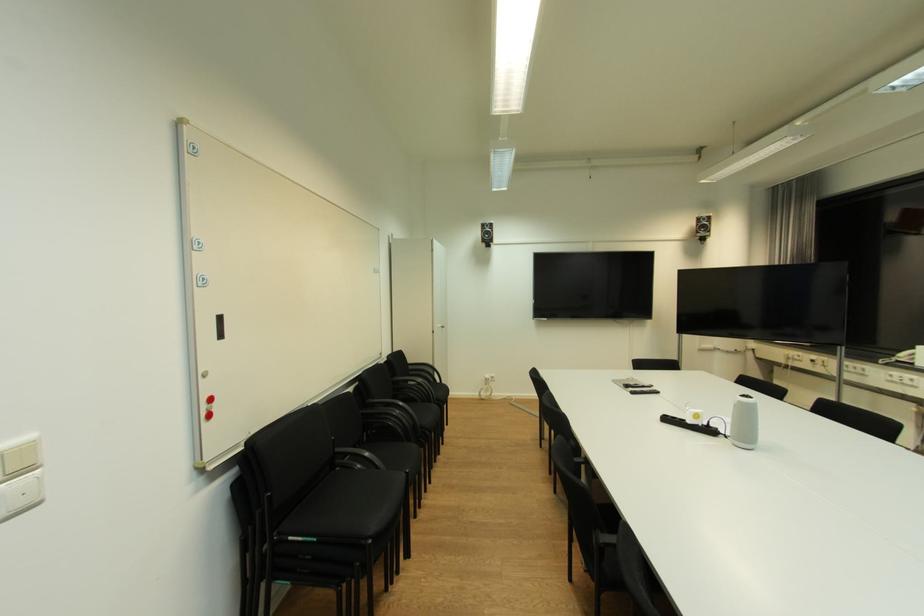
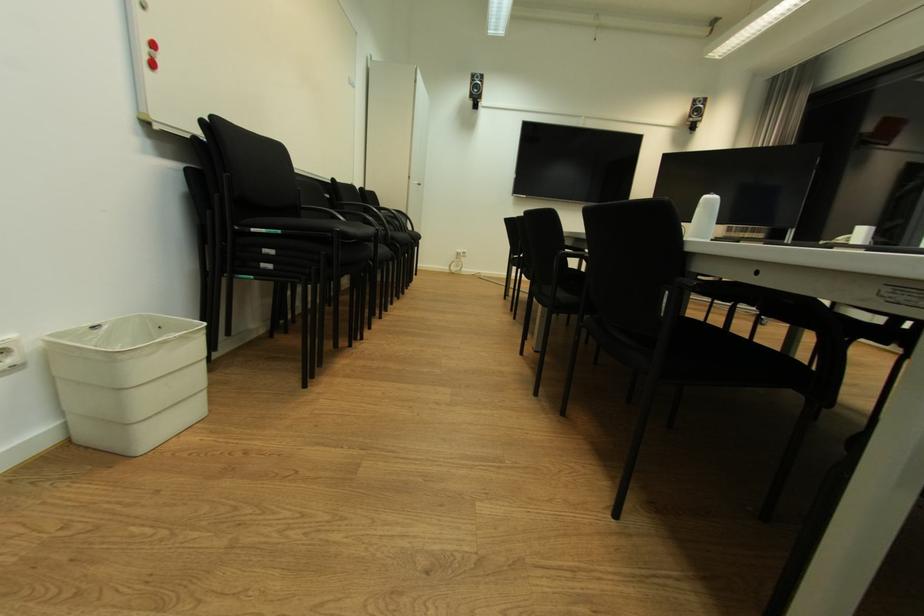
Question: Based on the continuous images, in which direction is the camera rotating? Reply with the corresponding letter.

Choices:
 (A) Left
 (B) Right
 (C) Up
 (D) Down

Answer: (D)